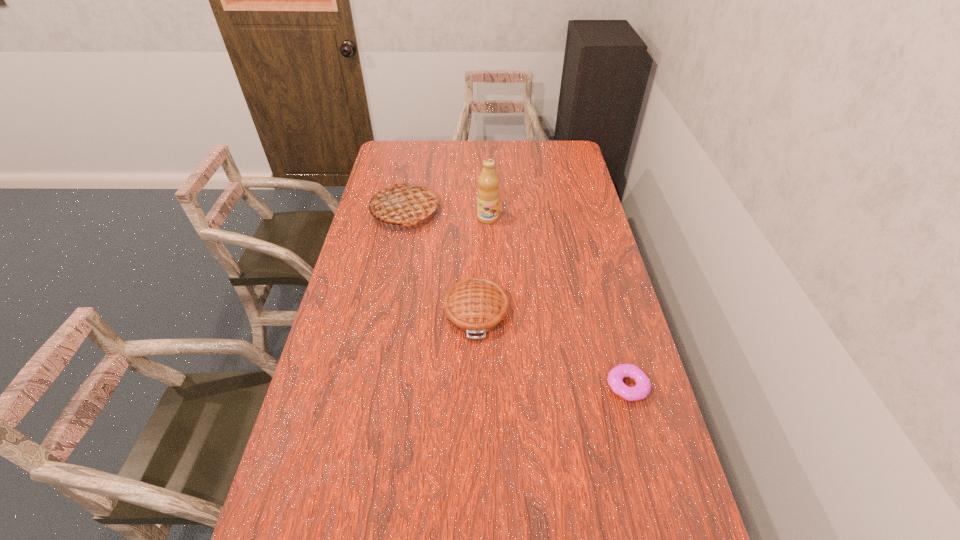
I want to click on vacant space in between the shortest object and the right pie, so click(552, 349).

At what (x,y) coordinates should I click in order to perform the action: click on vacant region between the right pie and the olive oil. Please return your answer as a coordinate pair (x, y). This screenshot has width=960, height=540. Looking at the image, I should click on (482, 265).

Where is `vacant space in between the olive oil and the left pie`? The image size is (960, 540). vacant space in between the olive oil and the left pie is located at coordinates (446, 215).

You are a GUI agent. You are given a task and a screenshot of the screen. Output one action in this format:
    pyautogui.click(x=<x>, y=<y>)
    Task: Click on the free space between the second tallest object and the second nearest object
    Image resolution: width=960 pixels, height=540 pixels.
    Given the screenshot: What is the action you would take?
    pyautogui.click(x=441, y=262)

This screenshot has width=960, height=540. I want to click on unoccupied position between the farther pie and the rightmost object, so [516, 299].

The height and width of the screenshot is (540, 960). What are the coordinates of `vacant space that is in between the farther pie and the tallest object` in the screenshot? It's located at (446, 215).

Identify the location of free point between the nearest object and the taller pie. (516, 299).

Select which object is the closest to the left pie. Please provide its 2D coordinates. Your answer should be formatted as a tuple, i.e. [(x, y)], where the tuple contains the x and y coordinates of a point satisfying the conditions above.

[(488, 193)]

Find the location of a particular element. The width and height of the screenshot is (960, 540). object that is the second nearest to the taller pie is located at coordinates (476, 306).

Locate an element on the screen. The height and width of the screenshot is (540, 960). free location that satisfies the following two spatial constraints: 1. on the front side of the taller pie; 2. on the left side of the shortest object is located at coordinates (371, 386).